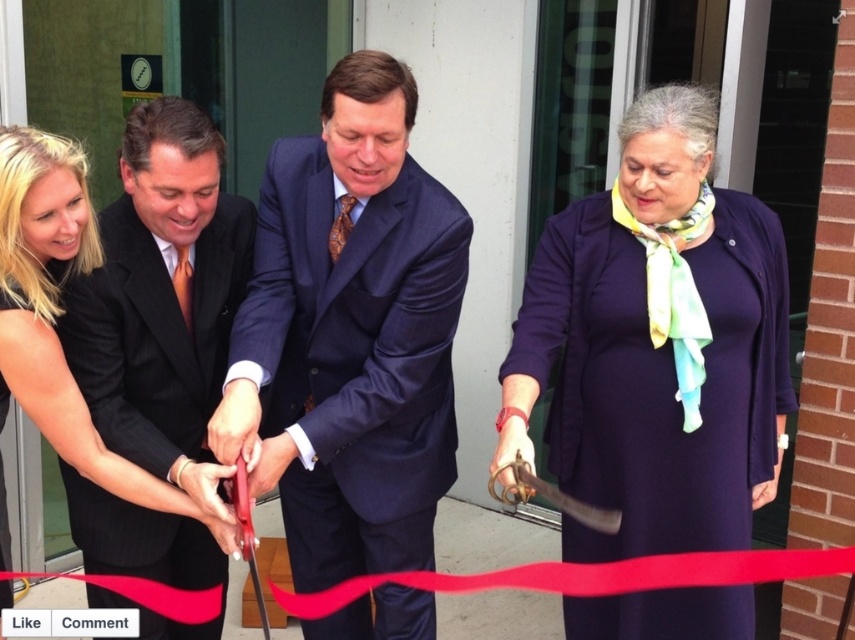
Question: Estimate the real-world distances between objects in this image. Which object is closer to the yellow-green silk scarf at center?

Choices:
 (A) shiny blue suit at center
 (B) black silk dress at center

Answer: (A)

Question: Which object appears farthest from the camera in this image?

Choices:
 (A) yellow-green silk scarf at center
 (B) black silk dress at center
 (C) purple fabric dress at center
 (D) shiny blue suit at center

Answer: (A)

Question: Which point is farther to the camera?

Choices:
 (A) purple fabric dress at center
 (B) black silk dress at center

Answer: (A)

Question: Does purple fabric dress at center have a greater width compared to black silk dress at center?

Choices:
 (A) no
 (B) yes

Answer: (B)

Question: Does shiny blue suit at center have a smaller size compared to black silk dress at center?

Choices:
 (A) no
 (B) yes

Answer: (A)

Question: Does black silk dress at center have a lesser width compared to yellow-green silk scarf at center?

Choices:
 (A) yes
 (B) no

Answer: (B)